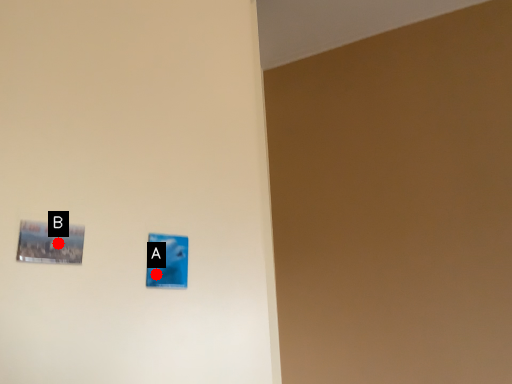
Question: Two points are circled on the image, labeled by A and B beside each circle. Which point is closer to the camera?

Choices:
 (A) A is closer
 (B) B is closer

Answer: (B)